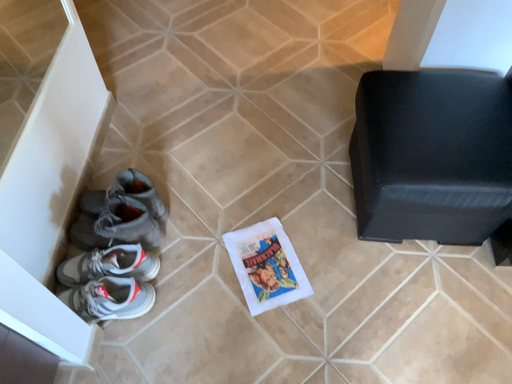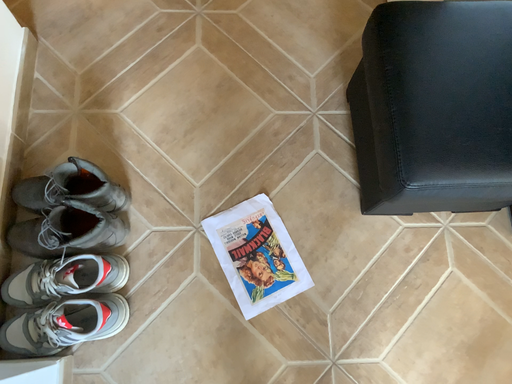
Question: How did the camera likely rotate when shooting the video?

Choices:
 (A) rotated upward
 (B) rotated downward

Answer: (B)